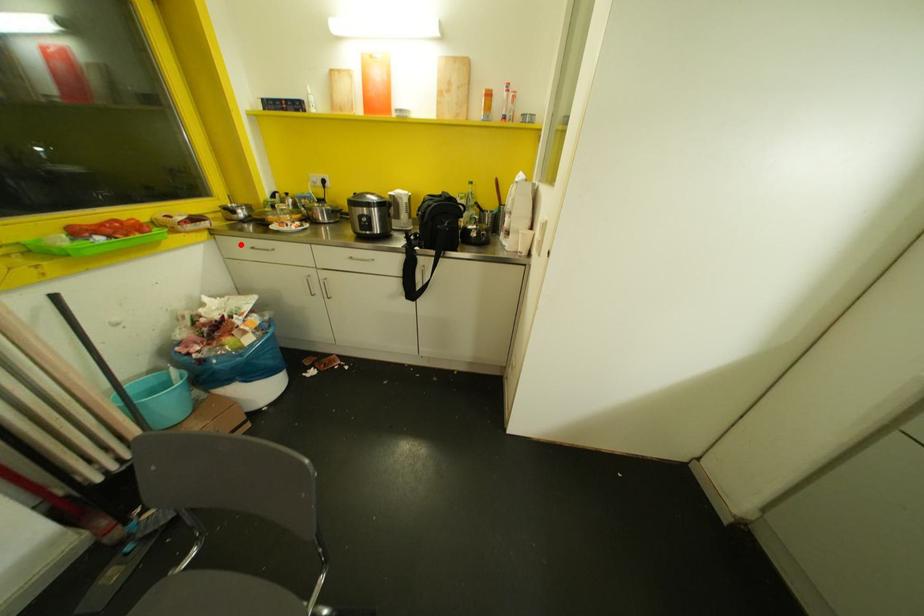
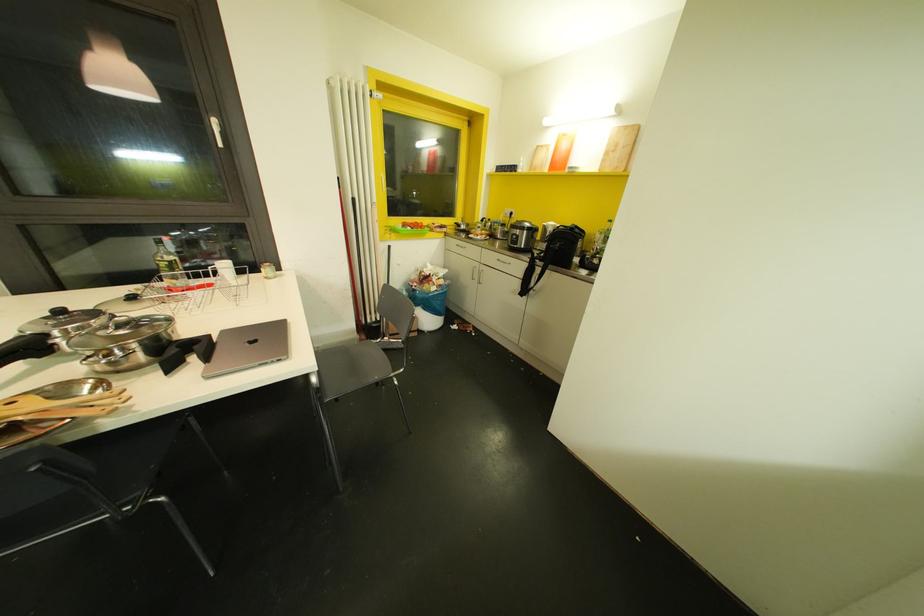
In the second image, find the point that corresponds to the highlighted location in the first image.

(453, 243)